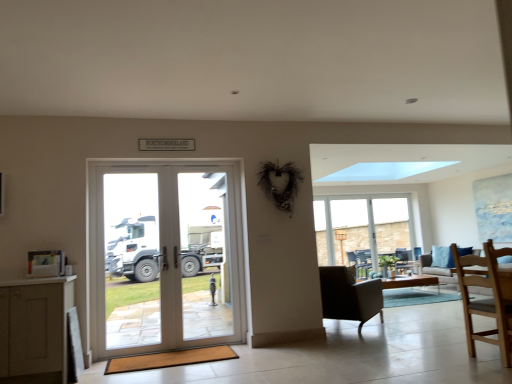
Question: Considering the relative sizes of dark brown leather armchair at right and green matte vase at center in the image provided, is dark brown leather armchair at right shorter than green matte vase at center?

Choices:
 (A) no
 (B) yes

Answer: (B)

Question: Is the position of dark brown leather armchair at right more distant than that of green matte vase at center?

Choices:
 (A) no
 (B) yes

Answer: (B)

Question: From a real-world perspective, is dark brown leather armchair at right physically above green matte vase at center?

Choices:
 (A) no
 (B) yes

Answer: (B)

Question: Can you confirm if dark brown leather armchair at right is bigger than green matte vase at center?

Choices:
 (A) yes
 (B) no

Answer: (B)

Question: Does dark brown leather armchair at right have a lesser width compared to green matte vase at center?

Choices:
 (A) yes
 (B) no

Answer: (A)

Question: Is dark brown leather armchair at right facing away from green matte vase at center?

Choices:
 (A) no
 (B) yes

Answer: (A)

Question: Can you confirm if white glass door at center is thinner than clear glass window at center?

Choices:
 (A) no
 (B) yes

Answer: (B)

Question: From a real-world perspective, is white glass door at center physically below clear glass window at center?

Choices:
 (A) no
 (B) yes

Answer: (A)

Question: From a real-world perspective, is white glass door at center on top of clear glass window at center?

Choices:
 (A) no
 (B) yes

Answer: (B)

Question: Can you confirm if white glass door at center is smaller than clear glass window at center?

Choices:
 (A) yes
 (B) no

Answer: (A)

Question: Does white glass door at center appear on the right side of clear glass window at center?

Choices:
 (A) yes
 (B) no

Answer: (B)

Question: From the image's perspective, is white glass door at center on clear glass window at center?

Choices:
 (A) no
 (B) yes

Answer: (B)

Question: Is green matte vase at center located within clear glass door at center?

Choices:
 (A) no
 (B) yes

Answer: (A)